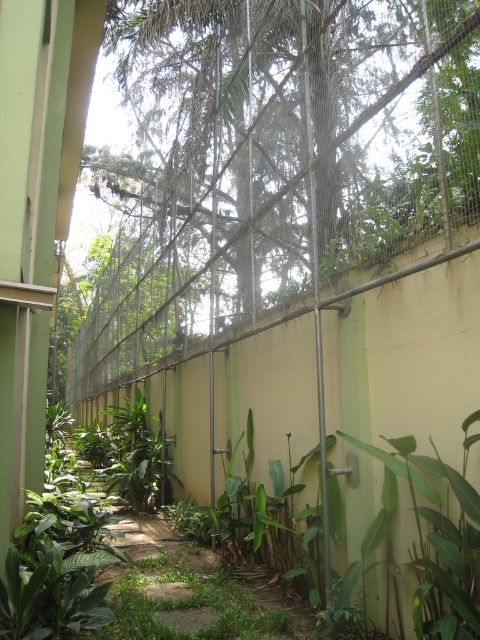
Question: Which point appears farthest from the camera in this image?

Choices:
 (A) (478, 589)
 (B) (182, 627)

Answer: (B)

Question: Does green grassy path at center have a larger size compared to green leafy plants at lower left?

Choices:
 (A) no
 (B) yes

Answer: (B)

Question: Is green grassy path at center to the left of green leafy plants at lower left from the viewer's perspective?

Choices:
 (A) no
 (B) yes

Answer: (B)

Question: Can you confirm if green grassy path at center is thinner than green leafy plants at lower left?

Choices:
 (A) yes
 (B) no

Answer: (B)

Question: Which point is farther to the camera?

Choices:
 (A) green grassy path at center
 (B) green leafy plants at lower left

Answer: (A)